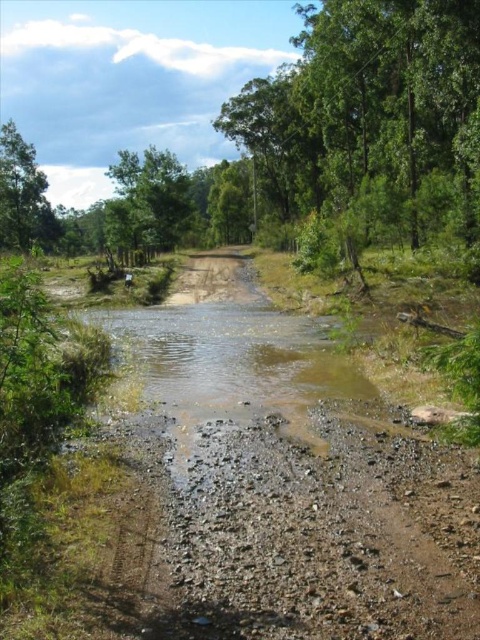
Question: Is green leafy tree at center to the left of green leafy tree at upper left from the viewer's perspective?

Choices:
 (A) yes
 (B) no

Answer: (B)

Question: In this image, where is green leafy tree at center located relative to green leafy tree at upper left?

Choices:
 (A) left
 (B) right

Answer: (B)

Question: Which point is closer to the camera taking this photo?

Choices:
 (A) (24, 154)
 (B) (187, 227)

Answer: (A)

Question: Does green leafy tree at center have a lesser width compared to green leafy tree at upper left?

Choices:
 (A) yes
 (B) no

Answer: (B)